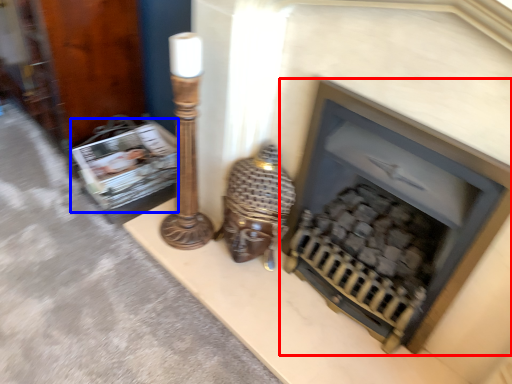
Question: Which object is further to the camera taking this photo, fireplace (highlighted by a red box) or magazine (highlighted by a blue box)?

Choices:
 (A) fireplace
 (B) magazine

Answer: (B)